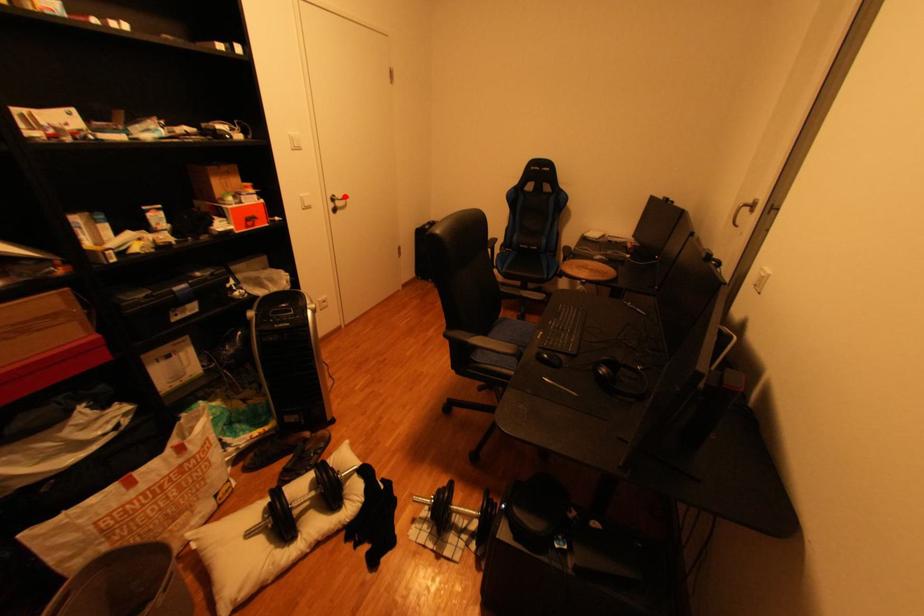
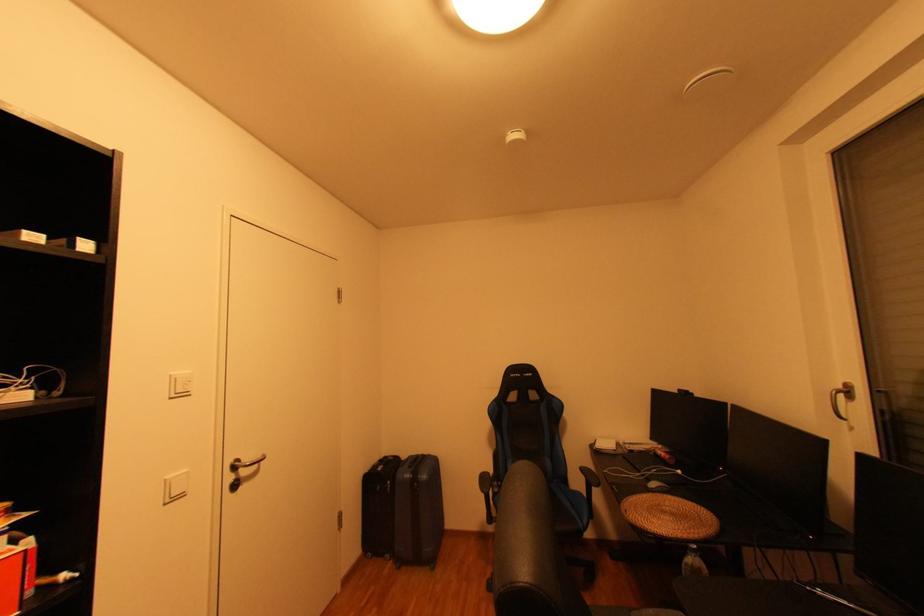
Locate, in the second image, the point that corresponds to the highlighted location in the first image.

(247, 461)